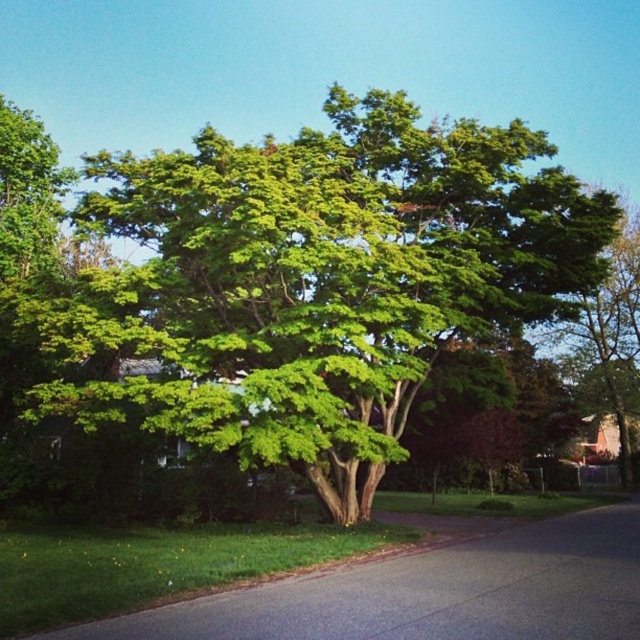
Is green leafy tree at center taller than green leafy tree at right?

Incorrect, green leafy tree at center's height is not larger of green leafy tree at right's.

Who is more distant from viewer, [362,496] or [625,289]?

Point [625,289]

Image resolution: width=640 pixels, height=640 pixels. I want to click on green leafy tree at center, so click(x=316, y=282).